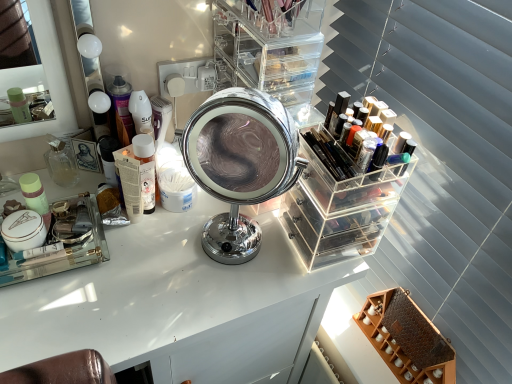
This screenshot has width=512, height=384. I want to click on shiny black lipstick at upper right, which is the 3th toiletry from back to front, so click(338, 110).

This screenshot has width=512, height=384. What do you see at coordinates (146, 170) in the screenshot?
I see `translucent plastic bottle at left, the 2th toiletry in the left-to-right sequence` at bounding box center [146, 170].

Measure the distance between point (154, 206) and camera.

Point (154, 206) and camera are 37.52 inches apart.

Where is `transparent acrylic organizer at center right`? transparent acrylic organizer at center right is located at coordinates coord(339,207).

Identify the location of clear acrylic organizer at center, which appears as the first shelf when viewed from the top. This screenshot has height=384, width=512. (268, 49).

You are a GUI agent. You are given a task and a screenshot of the screen. Output one action in this format:
    pyautogui.click(x=<x>, y=<y>)
    Task: Click on the shiny black lipstick at upper right, which is counted as the third toiletry, starting from the left
    The height and width of the screenshot is (384, 512).
    Given the screenshot: What is the action you would take?
    pyautogui.click(x=338, y=110)

Is shiny black lipstick at upper right, which is counted as the third toiletry, starting from the left, outside of chrome/metallic mirror at center?

Absolutely, shiny black lipstick at upper right, which is counted as the third toiletry, starting from the left, is external to chrome/metallic mirror at center.

Is the depth of shiny black lipstick at upper right, the 1th toiletry viewed from the front, less than that of chrome/metallic mirror at center?

No, shiny black lipstick at upper right, the 1th toiletry viewed from the front, is further to the viewer.

Is shiny black lipstick at upper right, which is counted as the third toiletry, starting from the left, to the right of chrome/metallic mirror at center from the viewer's perspective?

Correct, you'll find shiny black lipstick at upper right, which is counted as the third toiletry, starting from the left, to the right of chrome/metallic mirror at center.

Is shiny black lipstick at upper right, which is the 3th toiletry from back to front, smaller than chrome/metallic mirror at center?

Yes, shiny black lipstick at upper right, which is the 3th toiletry from back to front, is smaller than chrome/metallic mirror at center.

In terms of size, does transparent acrylic organizer at center right appear bigger or smaller than white glossy table at center?

Clearly, transparent acrylic organizer at center right is smaller in size than white glossy table at center.

Can we say transparent acrylic organizer at center right lies outside white glossy table at center?

Yes.

In the scene shown: Is transparent acrylic organizer at center right next to white glossy table at center?

There is a gap between transparent acrylic organizer at center right and white glossy table at center.

Visually, is transparent acrylic organizer at center right positioned to the left or to the right of white glossy table at center?

In the image, transparent acrylic organizer at center right appears on the right side of white glossy table at center.

Is wooden honeycomb-patterned shelf at lower right, positioned as the 1th shelf in bottom-to-top order, further to camera compared to chrome/metallic mirror at center?

That is True.

From the image's perspective, which object appears higher, wooden honeycomb-patterned shelf at lower right, marked as the second shelf in a top-to-bottom arrangement, or chrome/metallic mirror at center?

chrome/metallic mirror at center appears higher in the image.

The height and width of the screenshot is (384, 512). I want to click on scale above the wooden honeycomb-patterned shelf at lower right, which appears as the 1th shelf when viewed from the right (from the image's perspective), so click(x=240, y=164).

Is wooden honeycomb-patterned shelf at lower right, which appears as the 1th shelf when viewed from the right, inside the boundaries of chrome/metallic mirror at center, or outside?

wooden honeycomb-patterned shelf at lower right, which appears as the 1th shelf when viewed from the right, is located beyond the bounds of chrome/metallic mirror at center.

Which of these two, clear acrylic organizer at center, positioned as the 1th shelf in left-to-right order, or shiny black lipstick at upper right, which is the 3th toiletry from back to front, stands taller?

clear acrylic organizer at center, positioned as the 1th shelf in left-to-right order.

Looking at this image, from the image's perspective, is clear acrylic organizer at center, which is the second shelf in bottom-to-top order, located above shiny black lipstick at upper right, which is the 3th toiletry from back to front?

Yes, from the image's perspective, clear acrylic organizer at center, which is the second shelf in bottom-to-top order, is on top of shiny black lipstick at upper right, which is the 3th toiletry from back to front.

From a real-world perspective, which is physically below, clear acrylic organizer at center, the second shelf when ordered from right to left, or shiny black lipstick at upper right, which is counted as the third toiletry, starting from the left?

In real-world perspective, shiny black lipstick at upper right, which is counted as the third toiletry, starting from the left, is lower.

Is clear acrylic organizer at center, the second shelf when ordered from right to left, positioned beyond the bounds of shiny black lipstick at upper right, which is counted as the first toiletry, starting from the right?

Yes.

Could you tell me if wooden honeycomb-patterned shelf at lower right, positioned as the 1th shelf in bottom-to-top order, is turned towards translucent plastic bottle at left, the 2th toiletry in the left-to-right sequence?

No, wooden honeycomb-patterned shelf at lower right, positioned as the 1th shelf in bottom-to-top order, is not turned towards translucent plastic bottle at left, the 2th toiletry in the left-to-right sequence.

Can you confirm if wooden honeycomb-patterned shelf at lower right, acting as the 2th shelf starting from the left, is thinner than translucent plastic bottle at left, the 2th toiletry positioned from the back?

In fact, wooden honeycomb-patterned shelf at lower right, acting as the 2th shelf starting from the left, might be wider than translucent plastic bottle at left, the 2th toiletry positioned from the back.

Which is closer, (433,351) or (134,151)?

The point (134,151) is closer to the camera.

Based on the photo, is wooden honeycomb-patterned shelf at lower right, which appears as the 1th shelf when viewed from the right, positioned with its back to translucent glass perfume bottle at left, positioned as the first toiletry in left-to-right order?

That's not correct — wooden honeycomb-patterned shelf at lower right, which appears as the 1th shelf when viewed from the right, is not looking away from translucent glass perfume bottle at left, positioned as the first toiletry in left-to-right order.

Where is `the 3rd toiletry behind the wooden honeycomb-patterned shelf at lower right, marked as the second shelf in a top-to-bottom arrangement`? the 3rd toiletry behind the wooden honeycomb-patterned shelf at lower right, marked as the second shelf in a top-to-bottom arrangement is located at coordinates (61, 162).

From their relative heights in the image, would you say wooden honeycomb-patterned shelf at lower right, marked as the second shelf in a top-to-bottom arrangement, is taller or shorter than translucent glass perfume bottle at left, positioned as the 3th toiletry in right-to-left order?

Considering their sizes, wooden honeycomb-patterned shelf at lower right, marked as the second shelf in a top-to-bottom arrangement, has more height than translucent glass perfume bottle at left, positioned as the 3th toiletry in right-to-left order.

Is wooden honeycomb-patterned shelf at lower right, acting as the 2th shelf starting from the left, far away from translucent glass perfume bottle at left, the 3th toiletry positioned from the front?

That's not correct — wooden honeycomb-patterned shelf at lower right, acting as the 2th shelf starting from the left, is a little close to translucent glass perfume bottle at left, the 3th toiletry positioned from the front.

Based on their sizes in the image, would you say transparent acrylic organizer at center right is bigger or smaller than wooden honeycomb-patterned shelf at lower right, positioned as the 1th shelf in bottom-to-top order?

transparent acrylic organizer at center right is bigger than wooden honeycomb-patterned shelf at lower right, positioned as the 1th shelf in bottom-to-top order.

From the image's perspective, is transparent acrylic organizer at center right above or below wooden honeycomb-patterned shelf at lower right, which appears as the 1th shelf when viewed from the right?

From the image's perspective, transparent acrylic organizer at center right appears above wooden honeycomb-patterned shelf at lower right, which appears as the 1th shelf when viewed from the right.

What are the coordinates of `glass box that is above the wooden honeycomb-patterned shelf at lower right, acting as the 2th shelf starting from the left (from a real-world perspective)` in the screenshot? It's located at [339, 207].

Does transparent acrylic organizer at center right turn towards wooden honeycomb-patterned shelf at lower right, marked as the second shelf in a top-to-bottom arrangement?

No.

From the chrome/metallic mirror at center, count 1st toiletrys backward and point to it. Please provide its 2D coordinates.

[(338, 110)]

Where is `table directly beneath the transparent acrylic organizer at center right (from a real-world perspective)`? This screenshot has width=512, height=384. table directly beneath the transparent acrylic organizer at center right (from a real-world perspective) is located at coordinates (177, 305).

Based on their spatial positions, is shiny black lipstick at upper right, which is counted as the third toiletry, starting from the left, or wooden honeycomb-patterned shelf at lower right, acting as the 2th shelf starting from the left, further from white glossy table at center?

shiny black lipstick at upper right, which is counted as the third toiletry, starting from the left.

Based on their spatial positions, is wooden honeycomb-patterned shelf at lower right, positioned as the 1th shelf in bottom-to-top order, or clear glass mirror at upper left further from translucent plastic bottle at left, the 2th toiletry when ordered from front to back?

clear glass mirror at upper left lies further to translucent plastic bottle at left, the 2th toiletry when ordered from front to back, than the other object.

Which object lies nearer to the anchor point shiny black lipstick at upper right, which is counted as the third toiletry, starting from the left, transparent acrylic organizer at center right or chrome/metallic mirror at center?

transparent acrylic organizer at center right is closer to shiny black lipstick at upper right, which is counted as the third toiletry, starting from the left.

Looking at the image, which one is located further to clear acrylic organizer at center, which is the second shelf in bottom-to-top order, wooden honeycomb-patterned shelf at lower right, which appears as the 1th shelf when viewed from the right, or translucent glass perfume bottle at left, positioned as the first toiletry in left-to-right order?

wooden honeycomb-patterned shelf at lower right, which appears as the 1th shelf when viewed from the right.

Looking at the image, which one is located further to white glossy table at center, chrome/metallic mirror at center or wooden honeycomb-patterned shelf at lower right, acting as the 2th shelf starting from the left?

Based on the image, wooden honeycomb-patterned shelf at lower right, acting as the 2th shelf starting from the left, appears to be further to white glossy table at center.

When comparing their distances from transparent acrylic organizer at center right, does shiny black lipstick at upper right, which is counted as the third toiletry, starting from the left, or wooden honeycomb-patterned shelf at lower right, which appears as the 1th shelf when viewed from the right, seem further?

wooden honeycomb-patterned shelf at lower right, which appears as the 1th shelf when viewed from the right.

Estimate the real-world distances between objects in this image. Which object is closer to clear acrylic organizer at center, positioned as the 1th shelf in left-to-right order, translucent glass perfume bottle at left, positioned as the first toiletry in left-to-right order, or wooden honeycomb-patterned shelf at lower right, marked as the second shelf in a top-to-bottom arrangement?

Among the two, translucent glass perfume bottle at left, positioned as the first toiletry in left-to-right order, is located nearer to clear acrylic organizer at center, positioned as the 1th shelf in left-to-right order.

Which object lies nearer to the anchor point chrome/metallic mirror at center, transparent acrylic organizer at center right or white glossy table at center?

transparent acrylic organizer at center right is closer to chrome/metallic mirror at center.

You are a GUI agent. You are given a task and a screenshot of the screen. Output one action in this format:
    pyautogui.click(x=<x>, y=<y>)
    Task: Click on the scale between clear glass mirror at upper left and transparent acrylic organizer at center right from left to right
    The width and height of the screenshot is (512, 384).
    Given the screenshot: What is the action you would take?
    pyautogui.click(x=240, y=164)

At what (x,y) coordinates should I click in order to perform the action: click on shelf situated between clear glass mirror at upper left and shiny black lipstick at upper right, which is counted as the first toiletry, starting from the right, from left to right. Please return your answer as a coordinate pair (x, y). Looking at the image, I should click on (268, 49).

In order to click on table between clear glass mirror at upper left and shiny black lipstick at upper right, which is counted as the first toiletry, starting from the right in this screenshot , I will do `click(177, 305)`.

The width and height of the screenshot is (512, 384). In order to click on shelf situated between clear glass mirror at upper left and transparent acrylic organizer at center right from left to right in this screenshot , I will do `click(268, 49)`.